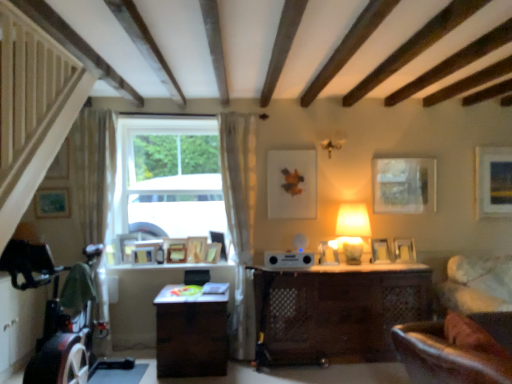
Describe the element at coordinates (292, 184) in the screenshot. I see `matte wooden picture frame at center, the 9th picture frame positioned from the left` at that location.

Where is `matte gold picture frame at upper right, the thirteenth picture frame in the left-to-right sequence`? The image size is (512, 384). matte gold picture frame at upper right, the thirteenth picture frame in the left-to-right sequence is located at coordinates (493, 181).

The height and width of the screenshot is (384, 512). Identify the location of white sheer curtain at center, which ranks as the 1th curtain in right-to-left order. (240, 220).

Where is `matte silver picture frame at right, placed as the tenth picture frame when sorted from left to right`? The width and height of the screenshot is (512, 384). matte silver picture frame at right, placed as the tenth picture frame when sorted from left to right is located at coordinates (380, 251).

In order to face dark wood table at center, should I rotate leftwards or rightwards?

You should rotate left by 8.214 degrees.

This screenshot has width=512, height=384. Describe the element at coordinates (175, 250) in the screenshot. I see `wooden picture frame at center, the 9th picture frame from the right` at that location.

You are a GUI agent. You are given a task and a screenshot of the screen. Output one action in this format:
    pyautogui.click(x=<x>, y=<y>)
    Task: Click on the matte wooden picture frame at center, which ranks as the 5th picture frame in right-to-left order
    Image resolution: width=512 pixels, height=384 pixels.
    Given the screenshot: What is the action you would take?
    pyautogui.click(x=292, y=184)

From the image's perspective, which object appears higher, velvet green swivel chair at lower right or wooden picture frame at window, the 4th picture frame when ordered from left to right?

wooden picture frame at window, the 4th picture frame when ordered from left to right.

Which object is more forward, velvet green swivel chair at lower right or wooden picture frame at window, the 4th picture frame when ordered from left to right?

Positioned in front is velvet green swivel chair at lower right.

Is velvet green swivel chair at lower right situated inside wooden picture frame at window, the 10th picture frame viewed from the right, or outside?

The correct answer is: outside.

Can you see velvet green swivel chair at lower right touching dark wood table at center?

velvet green swivel chair at lower right and dark wood table at center are clearly separated.

How different are the orientations of velvet green swivel chair at lower right and dark wood table at center in degrees?

38.9 degrees.

Does velvet green swivel chair at lower right have a lesser height compared to dark wood table at center?

Indeed, velvet green swivel chair at lower right has a lesser height compared to dark wood table at center.

From the image's perspective, which is below, white sheer curtain at left, the 1th curtain positioned from the left, or wooden picture frame at center, which is the 7th picture frame from right to left?

wooden picture frame at center, which is the 7th picture frame from right to left, from the image's perspective.

Looking at the image, does white sheer curtain at left, the 2th curtain from the right, seem bigger or smaller compared to wooden picture frame at center, the 7th picture frame from the left?

white sheer curtain at left, the 2th curtain from the right, is bigger than wooden picture frame at center, the 7th picture frame from the left.

Considering the points (298, 215) and (343, 215), which point is behind, point (298, 215) or point (343, 215)?

The point (298, 215) is farther from the camera.

Between matte wooden picture frame at center, the 9th picture frame positioned from the left, and matte white lampshade at upper right, which one has smaller width?

With smaller width is matte wooden picture frame at center, the 9th picture frame positioned from the left.

Does matte wooden picture frame at center, which ranks as the 5th picture frame in right-to-left order, have a lesser height compared to matte white lampshade at upper right?

In fact, matte wooden picture frame at center, which ranks as the 5th picture frame in right-to-left order, may be taller than matte white lampshade at upper right.

Based on their sizes in the image, would you say matte wooden picture frame at center, the 9th picture frame positioned from the left, is bigger or smaller than matte white lampshade at upper right?

In the image, matte wooden picture frame at center, the 9th picture frame positioned from the left, appears to be smaller than matte white lampshade at upper right.

Is velvet green swivel chair at lower right wider or thinner than white plastic speaker at center?

Considering their sizes, velvet green swivel chair at lower right looks slimmer than white plastic speaker at center.

Looking at this image, from the image's perspective, which one is positioned lower, velvet green swivel chair at lower right or white plastic speaker at center?

velvet green swivel chair at lower right.

Can you tell me how much velvet green swivel chair at lower right and white plastic speaker at center differ in facing direction?

37.1 degrees separate the facing orientations of velvet green swivel chair at lower right and white plastic speaker at center.

In the scene shown: From the image's perspective, between wooden picture frame at center, which is counted as the sixth picture frame, starting from the right, and dark wood table at center, who is located below?

dark wood table at center appears lower in the image.

Between wooden picture frame at center, the eighth picture frame when ordered from left to right, and dark wood table at center, which one has smaller width?

Thinner between the two is wooden picture frame at center, the eighth picture frame when ordered from left to right.

Considering the sizes of objects wooden picture frame at center, the eighth picture frame when ordered from left to right, and dark wood table at center in the image provided, who is taller, wooden picture frame at center, the eighth picture frame when ordered from left to right, or dark wood table at center?

dark wood table at center is taller.

Is wooden picture frame at center, the eighth picture frame when ordered from left to right, not within dark wood table at center?

Yes, wooden picture frame at center, the eighth picture frame when ordered from left to right, is located beyond the bounds of dark wood table at center.

From the image's perspective, is matte blue picture frame at upper left, which appears as the thirteenth picture frame when viewed from the right, beneath velvet green swivel chair at lower right?

Actually, matte blue picture frame at upper left, which appears as the thirteenth picture frame when viewed from the right, appears above velvet green swivel chair at lower right in the image.

Which object is closer to the camera, matte blue picture frame at upper left, acting as the first picture frame starting from the left, or velvet green swivel chair at lower right?

velvet green swivel chair at lower right is closer to the camera.

Is matte blue picture frame at upper left, which appears as the thirteenth picture frame when viewed from the right, positioned beyond the bounds of velvet green swivel chair at lower right?

Yes.

Is point (39, 213) farther from camera compared to point (488, 306)?

Yes, point (39, 213) is behind point (488, 306).

The width and height of the screenshot is (512, 384). I want to click on the 2nd picture frame above the velvet green swivel chair at lower right (from the image's perspective), so click(148, 252).

Locate an element on the screen. table behind the velvet green swivel chair at lower right is located at coordinates (191, 335).

Looking at the image, which one is located further to matte gold picture frame at upper right, the 1th picture frame positioned from the right, matte white lampshade at upper right or white plastic speaker at center?

white plastic speaker at center lies further to matte gold picture frame at upper right, the 1th picture frame positioned from the right, than the other object.

When comparing their distances from wooden picture frame at center, acting as the 8th picture frame starting from the right, does wooden picture frame at lower left, the 2th picture frame in the left-to-right sequence, or dark wood table at center seem closer?

Based on the image, wooden picture frame at lower left, the 2th picture frame in the left-to-right sequence, appears to be nearer to wooden picture frame at center, acting as the 8th picture frame starting from the right.

Considering their positions, is wooden picture frame at center, the eighth picture frame when ordered from left to right, positioned further to matte silver picture frame at right, positioned as the fourth picture frame in right-to-left order, than wooden picture frame at window, the 4th picture frame when ordered from left to right?

The object further to matte silver picture frame at right, positioned as the fourth picture frame in right-to-left order, is wooden picture frame at window, the 4th picture frame when ordered from left to right.

Based on their spatial positions, is wooden picture frame at window, which appears as the eleventh picture frame when viewed from the right, or white sheer curtain at center, which ranks as the 1th curtain in right-to-left order, closer to matte blue picture frame at upper left, acting as the first picture frame starting from the left?

wooden picture frame at window, which appears as the eleventh picture frame when viewed from the right.

Which object lies further to the anchor point matte silver picture frame at right, positioned as the fourth picture frame in right-to-left order, wooden picture frame at lower left, the 2th picture frame in the left-to-right sequence, or white sheer curtain at left, the 1th curtain positioned from the left?

white sheer curtain at left, the 1th curtain positioned from the left.

Estimate the real-world distances between objects in this image. Which object is further from matte wooden picture frame at center, the 9th picture frame positioned from the left, velvet green swivel chair at lower right or wooden picture frame at window, which is counted as the third picture frame, starting from the left?

Based on the image, velvet green swivel chair at lower right appears to be further to matte wooden picture frame at center, the 9th picture frame positioned from the left.

Looking at the image, which one is located closer to white sheer curtain at left, the 2th curtain from the right, matte blue picture frame at upper left, acting as the first picture frame starting from the left, or matte wooden picture frame at center-right, marked as the 11th picture frame in a left-to-right arrangement?

Among the two, matte blue picture frame at upper left, acting as the first picture frame starting from the left, is located nearer to white sheer curtain at left, the 2th curtain from the right.

Considering their positions, is wooden picture frame at center, which is the 7th picture frame from right to left, positioned closer to matte blue picture frame at upper left, acting as the first picture frame starting from the left, than white sheer curtain at left, the 2th curtain from the right?

white sheer curtain at left, the 2th curtain from the right.

Where is `curtain between dark wood table at center and matte silver picture frame at right, positioned as the fourth picture frame in right-to-left order, from left to right`? This screenshot has height=384, width=512. curtain between dark wood table at center and matte silver picture frame at right, positioned as the fourth picture frame in right-to-left order, from left to right is located at coordinates (240, 220).

Where is `speaker located between wooden picture frame at window, which is counted as the third picture frame, starting from the left, and matte wooden picture frame at center, the 9th picture frame positioned from the left, in the left-right direction`? speaker located between wooden picture frame at window, which is counted as the third picture frame, starting from the left, and matte wooden picture frame at center, the 9th picture frame positioned from the left, in the left-right direction is located at coordinates (288, 259).

Where is `table between matte blue picture frame at upper left, acting as the first picture frame starting from the left, and white plastic speaker at center`? table between matte blue picture frame at upper left, acting as the first picture frame starting from the left, and white plastic speaker at center is located at coordinates (191, 335).

At what (x,y) coordinates should I click in order to perform the action: click on table lamp between wooden picture frame at lower left, the 12th picture frame when ordered from right to left, and wooden picture frame at upper right, the 2th picture frame when ordered from right to left, in the horizontal direction. Please return your answer as a coordinate pair (x, y). The image size is (512, 384). Looking at the image, I should click on (353, 230).